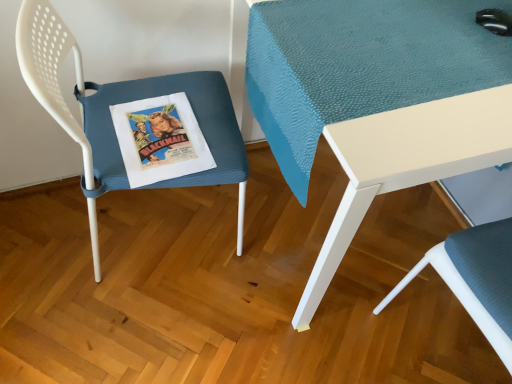
Question: Considering the relative positions of textured blue cushion at lower right, placed as the second chair when sorted from left to right, and blue textured cushion at left, which appears as the 2th chair when viewed from the right, in the image provided, is textured blue cushion at lower right, placed as the second chair when sorted from left to right, in front of blue textured cushion at left, which appears as the 2th chair when viewed from the right,?

Choices:
 (A) yes
 (B) no

Answer: (A)

Question: Can blue textured cushion at left, which appears as the 2th chair when viewed from the right, be found inside textured blue cushion at lower right, the first chair positioned from the right?

Choices:
 (A) no
 (B) yes

Answer: (A)

Question: Is textured blue cushion at lower right, the first chair positioned from the right, touching blue textured cushion at left, which is the 1th chair from left to right?

Choices:
 (A) no
 (B) yes

Answer: (A)

Question: Is textured blue cushion at lower right, the first chair positioned from the right, shorter than blue textured cushion at left, which is the 1th chair from left to right?

Choices:
 (A) no
 (B) yes

Answer: (A)

Question: Does textured blue cushion at lower right, placed as the second chair when sorted from left to right, turn towards blue textured cushion at left, which is the 1th chair from left to right?

Choices:
 (A) no
 (B) yes

Answer: (A)

Question: Is blue textured cushion at left, which appears as the 2th chair when viewed from the right, taller or shorter than teal fabric table at center?

Choices:
 (A) short
 (B) tall

Answer: (B)

Question: Looking at their shapes, would you say blue textured cushion at left, which is the 1th chair from left to right, is wider or thinner than teal fabric table at center?

Choices:
 (A) thin
 (B) wide

Answer: (A)

Question: Is blue textured cushion at left, which appears as the 2th chair when viewed from the right, in front of or behind teal fabric table at center in the image?

Choices:
 (A) front
 (B) behind

Answer: (A)

Question: Which is correct: blue textured cushion at left, which is the 1th chair from left to right, is inside teal fabric table at center, or outside of it?

Choices:
 (A) inside
 (B) outside

Answer: (B)

Question: Is textured blue cushion at lower right, the first chair positioned from the right, taller or shorter than blue textured cushion at left, which is the 1th chair from left to right?

Choices:
 (A) tall
 (B) short

Answer: (A)

Question: From the image's perspective, is textured blue cushion at lower right, the first chair positioned from the right, positioned above or below blue textured cushion at left, which is the 1th chair from left to right?

Choices:
 (A) above
 (B) below

Answer: (B)

Question: Does point (438, 258) appear closer or farther from the camera than point (96, 107)?

Choices:
 (A) closer
 (B) farther

Answer: (A)

Question: Which is correct: textured blue cushion at lower right, placed as the second chair when sorted from left to right, is inside blue textured cushion at left, which is the 1th chair from left to right, or outside of it?

Choices:
 (A) outside
 (B) inside

Answer: (A)

Question: From a real-world perspective, is teal fabric table at center above or below textured blue cushion at lower right, the first chair positioned from the right?

Choices:
 (A) below
 (B) above

Answer: (A)

Question: From the image's perspective, is teal fabric table at center above or below textured blue cushion at lower right, placed as the second chair when sorted from left to right?

Choices:
 (A) below
 (B) above

Answer: (B)